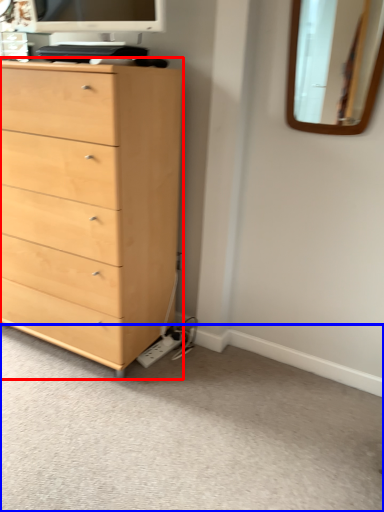
Question: Which object is closer to the camera taking this photo, chest of drawers (highlighted by a red box) or plain (highlighted by a blue box)?

Choices:
 (A) chest of drawers
 (B) plain

Answer: (B)